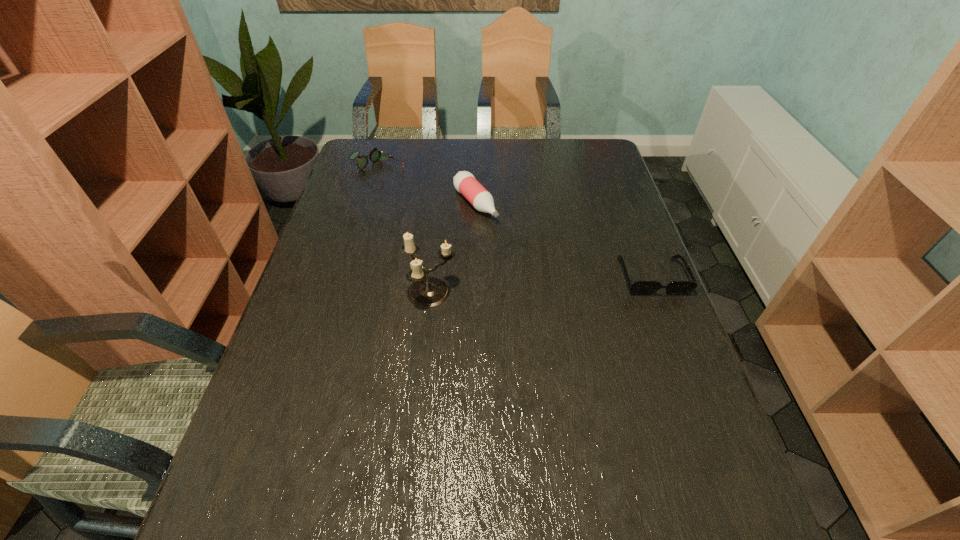
The height and width of the screenshot is (540, 960). What are the coordinates of `vacant space at the left edge` in the screenshot? It's located at (308, 393).

Identify the location of free space at the right edge. (626, 359).

You are a GUI agent. You are given a task and a screenshot of the screen. Output one action in this format:
    pyautogui.click(x=<x>, y=<y>)
    Task: Click on the free space at the near left corner
    
    Given the screenshot: What is the action you would take?
    pyautogui.click(x=276, y=478)

In order to click on vacant space at the far right corner of the desktop in this screenshot , I will do `click(572, 153)`.

The image size is (960, 540). What are the coordinates of `empty space that is in between the third nearest object and the tallest object` in the screenshot? It's located at (453, 248).

Where is `free spot between the third shortest object and the leftmost object`? Image resolution: width=960 pixels, height=540 pixels. free spot between the third shortest object and the leftmost object is located at coordinates (426, 187).

Where is `free space that is in between the spectacles and the sunglasses`? This screenshot has width=960, height=540. free space that is in between the spectacles and the sunglasses is located at coordinates (515, 224).

The image size is (960, 540). I want to click on vacant space that's between the farthest object and the candle holder, so click(x=404, y=232).

Locate an element on the screen. This screenshot has width=960, height=540. unoccupied position between the spectacles and the second tallest object is located at coordinates pos(426,187).

In order to click on free space between the second tallest object and the candle holder in this screenshot , I will do `click(453, 248)`.